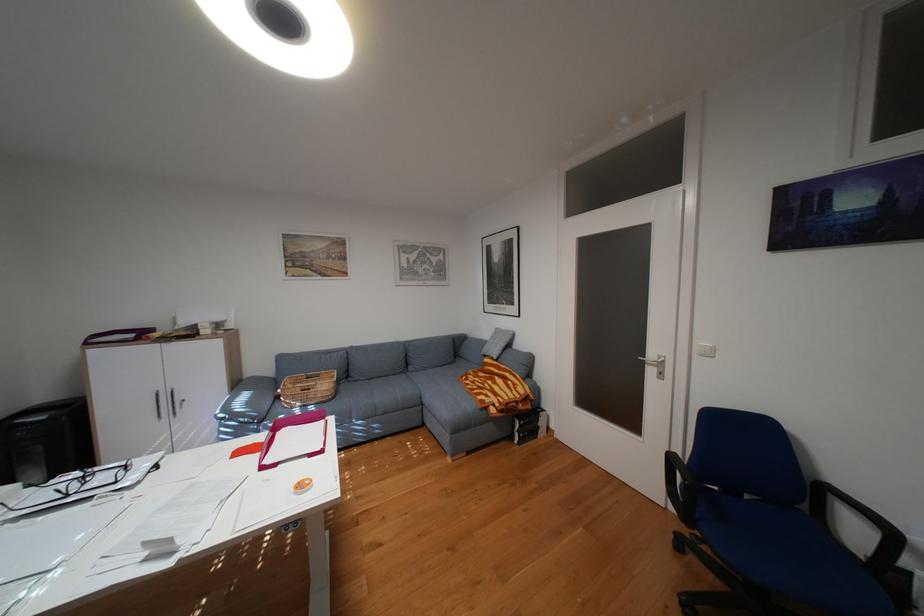
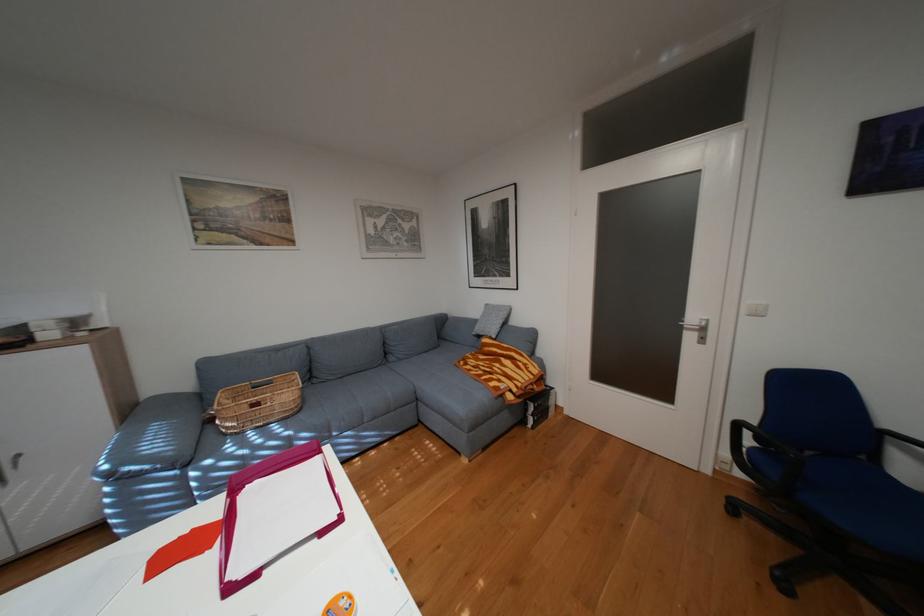
In a continuous first-person perspective shot, in which direction is the camera moving?

The movement direction of the cameraman is left, forward.